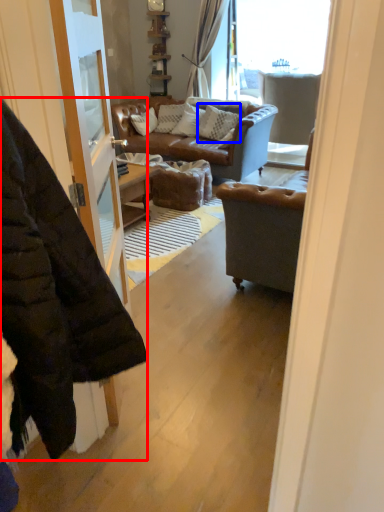
Question: Among these objects, which one is nearest to the camera, jacket (highlighted by a red box) or pillow (highlighted by a blue box)?

Choices:
 (A) jacket
 (B) pillow

Answer: (A)